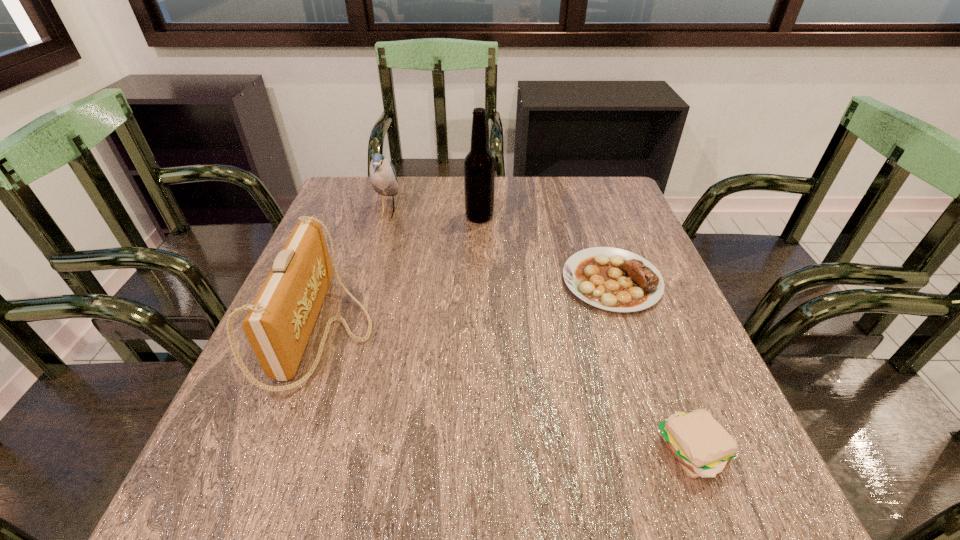
Where is `object that is at the near right corner`? object that is at the near right corner is located at coordinates (701, 445).

The image size is (960, 540). In the image, there is a desktop. What are the coordinates of `blank space at the far edge` in the screenshot? It's located at (500, 213).

The height and width of the screenshot is (540, 960). In the image, there is a desktop. What are the coordinates of `vacant space at the near edge` in the screenshot? It's located at (526, 510).

What are the coordinates of `free space at the left edge` in the screenshot? It's located at (330, 291).

Find the location of a particular element. This screenshot has width=960, height=540. vacant region at the right edge of the desktop is located at coordinates (586, 232).

Where is `vacant space at the far left corner of the desktop`? vacant space at the far left corner of the desktop is located at coordinates (346, 197).

At what (x,y) coordinates should I click in order to perform the action: click on free region at the far right corner of the desktop. Please return your answer as a coordinate pair (x, y). The image size is (960, 540). Looking at the image, I should click on (603, 181).

Image resolution: width=960 pixels, height=540 pixels. I want to click on vacant area that lies between the second shortest object and the bird, so click(540, 332).

This screenshot has height=540, width=960. In order to click on free space between the third object from left to right and the shortest object in this screenshot , I will do `click(545, 249)`.

Locate an element on the screen. Image resolution: width=960 pixels, height=540 pixels. unoccupied position between the handbag and the shortest object is located at coordinates (468, 306).